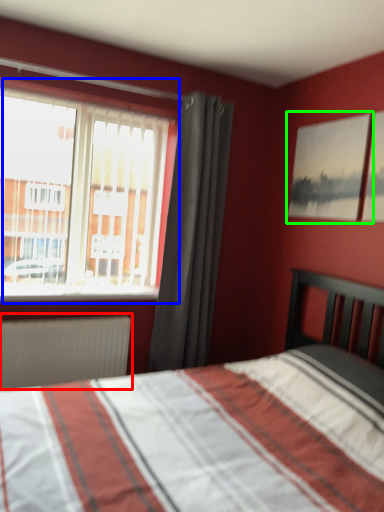
Question: Considering the real-world distances, which object is farthest from radiator (highlighted by a red box)? window (highlighted by a blue box) or picture frame (highlighted by a green box)?

Choices:
 (A) window
 (B) picture frame

Answer: (B)